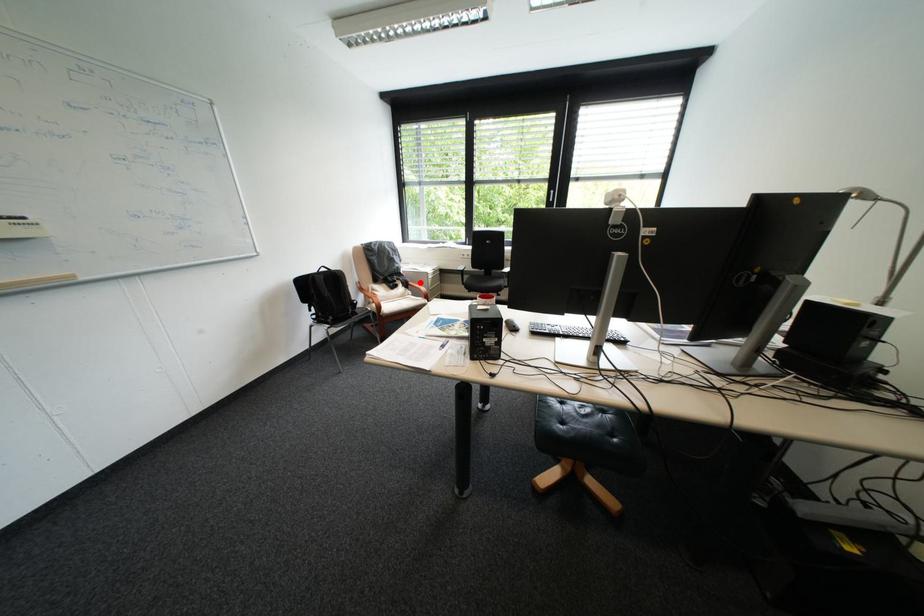
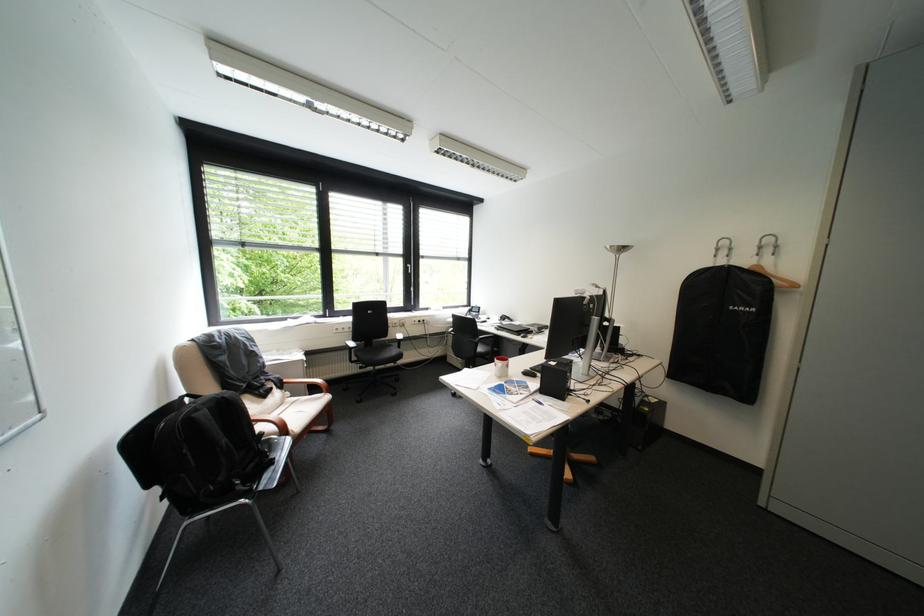
In the second image, find the point that corresponds to the highlighted location in the first image.

(294, 381)